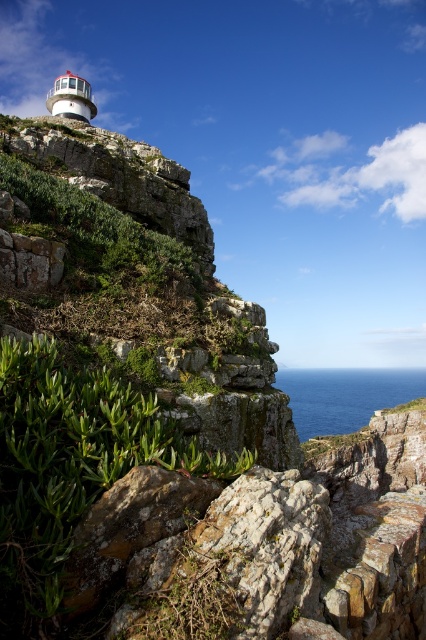
You are a hiker who wants to take a photo of the blue water at lower center. However, you notice the green leafy plant at center is blocking your view. Can you move the plant to the side to get a clear shot?

The green leafy plant at center is in front of blue water at lower center, so you can move the plant to the side to get a clear view of the blue water at lower center.

Consider the image. You are a botanist examining the coastal area. You notice the green leafy plant at center and the blue water at lower center. Which object has a narrower width?

The green leafy plant at center is thinner than the blue water at lower center, so the green leafy plant at center has a narrower width.